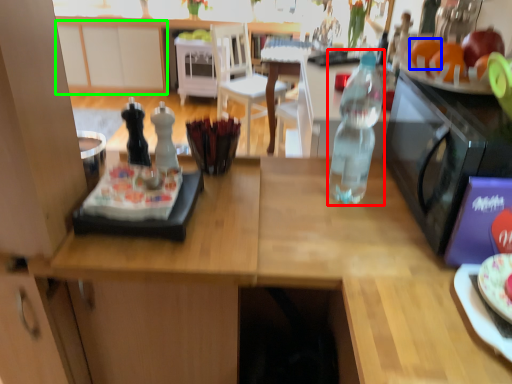
Question: Which object is the farthest from bottle (highlighted by a red box)? Choose among these: orange (highlighted by a blue box) or cabinetry (highlighted by a green box).

Choices:
 (A) orange
 (B) cabinetry

Answer: (B)